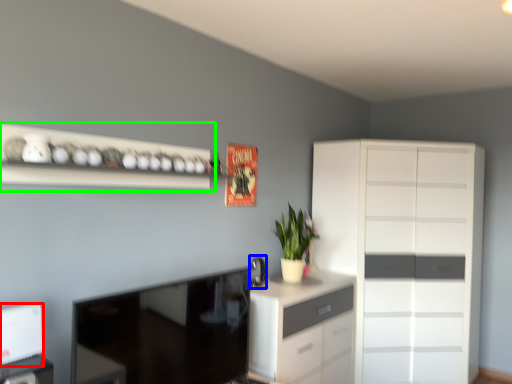
Question: Which object is the closest to the appliance (highlighted by a red box)? Choose among these: appliance (highlighted by a blue box) or shelf (highlighted by a green box).

Choices:
 (A) appliance
 (B) shelf

Answer: (B)